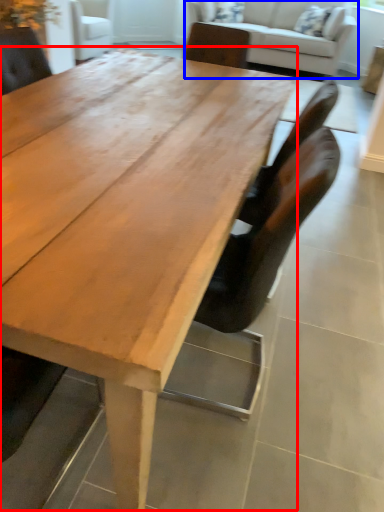
Question: Which object is further to the camera taking this photo, coffee table (highlighted by a red box) or studio couch (highlighted by a blue box)?

Choices:
 (A) coffee table
 (B) studio couch

Answer: (B)